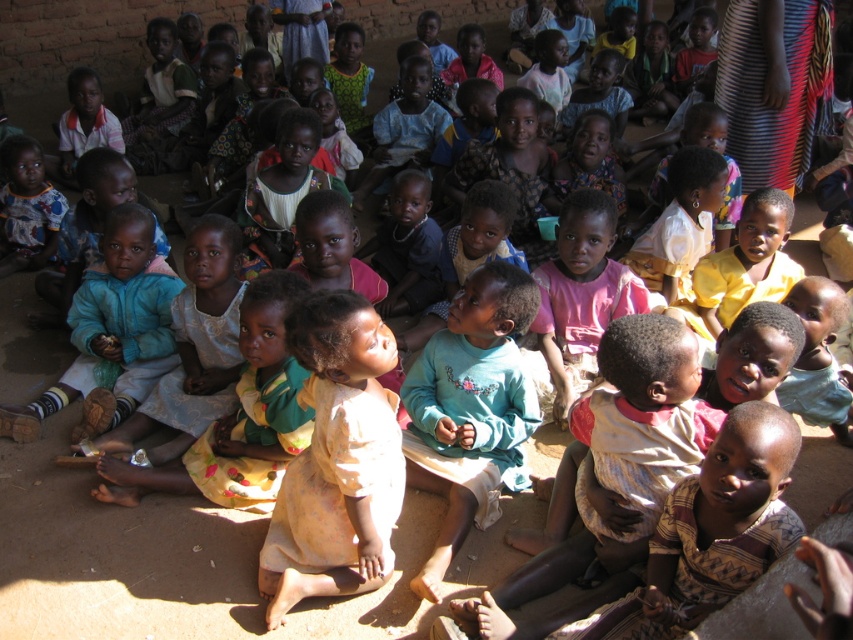
Is light yellow fabric at center shorter than light blue cotton shirt at center?

Correct, light yellow fabric at center is not as tall as light blue cotton shirt at center.

Find the location of a particular element. The image size is (853, 640). light yellow fabric at center is located at coordinates tap(337, 460).

Identify the location of light yellow fabric at center. (337, 460).